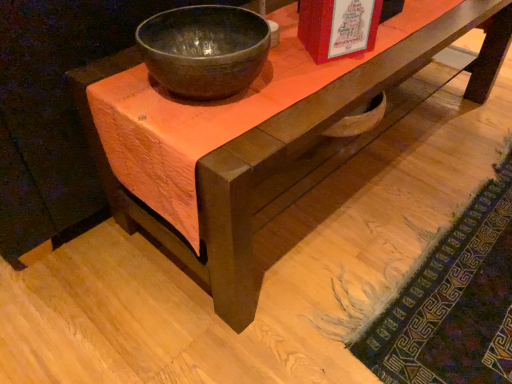
What are the coordinates of `matte dark gray bowl at center` in the screenshot? It's located at (204, 50).

Image resolution: width=512 pixels, height=384 pixels. What do you see at coordinates (204, 50) in the screenshot?
I see `matte dark gray bowl at center` at bounding box center [204, 50].

The height and width of the screenshot is (384, 512). What do you see at coordinates (453, 302) in the screenshot? I see `textured wool mat at lower right` at bounding box center [453, 302].

Image resolution: width=512 pixels, height=384 pixels. Identify the location of matte red book at upper center. (338, 27).

Is matte dark gray bowl at center next to matte red book at upper center and touching it?

No, matte dark gray bowl at center is not touching matte red book at upper center.

Is matte dark gray bowl at center behind matte red book at upper center?

No, matte dark gray bowl at center is closer to the camera.

Considering the relative sizes of matte dark gray bowl at center and matte red book at upper center in the image provided, is matte dark gray bowl at center taller than matte red book at upper center?

Incorrect, the height of matte dark gray bowl at center is not larger of that of matte red book at upper center.

From a real-world perspective, is matte dark gray bowl at center on top of matte red book at upper center?

No, from a real-world perspective, matte dark gray bowl at center is not over matte red book at upper center

From a real-world perspective, between matte dark gray bowl at center and textured wool mat at lower right, who is vertically lower?

textured wool mat at lower right, from a real-world perspective.

From the picture: Between matte dark gray bowl at center and textured wool mat at lower right, which one appears on the right side from the viewer's perspective?

Positioned to the right is textured wool mat at lower right.

Relative to textured wool mat at lower right, is matte dark gray bowl at center in front or behind?

matte dark gray bowl at center is positioned closer to the viewer than textured wool mat at lower right.

Between matte dark gray bowl at center and textured wool mat at lower right, which one has less height?

textured wool mat at lower right is shorter.

Between point (496, 326) and point (359, 46), which one is positioned behind?

The point (496, 326) is more distant.

Is textured wool mat at lower right facing away from matte red book at upper center?

No, textured wool mat at lower right is not facing the opposite direction of matte red book at upper center.

Which object is positioned more to the right, textured wool mat at lower right or matte red book at upper center?

From the viewer's perspective, textured wool mat at lower right appears more on the right side.

Is matte red book at upper center touching textured wool mat at lower right?

They are not placed beside each other.

Which object is closer to the camera, matte red book at upper center or textured wool mat at lower right?

textured wool mat at lower right is more forward.

From a real-world perspective, is matte red book at upper center on textured wool mat at lower right?

Correct, in the physical world, matte red book at upper center is higher than textured wool mat at lower right.

Is textured wool mat at lower right at the back of matte red book at upper center?

No, matte red book at upper center is not facing away from textured wool mat at lower right.

Does matte red book at upper center have a lesser height compared to matte dark gray bowl at center?

Incorrect, the height of matte red book at upper center does not fall short of that of matte dark gray bowl at center.

Looking at this image, between matte red book at upper center and matte dark gray bowl at center, which one has smaller size?

With smaller size is matte red book at upper center.

From a real-world perspective, does matte red book at upper center sit lower than matte dark gray bowl at center?

Incorrect, from a real-world perspective, matte red book at upper center is higher than matte dark gray bowl at center.

Measure the distance between matte red book at upper center and matte dark gray bowl at center.

matte red book at upper center and matte dark gray bowl at center are 21.60 centimeters apart from each other.

Considering the sizes of textured wool mat at lower right and matte dark gray bowl at center in the image, is textured wool mat at lower right wider or thinner than matte dark gray bowl at center?

Considering their sizes, textured wool mat at lower right looks broader than matte dark gray bowl at center.

Does textured wool mat at lower right turn towards matte dark gray bowl at center?

No, textured wool mat at lower right does not turn towards matte dark gray bowl at center.

Can you tell me how much textured wool mat at lower right and matte dark gray bowl at center differ in facing direction?

179 degrees separate the facing orientations of textured wool mat at lower right and matte dark gray bowl at center.

Is textured wool mat at lower right in front of matte dark gray bowl at center?

No, textured wool mat at lower right is further to the viewer.

The height and width of the screenshot is (384, 512). Identify the location of book cover behind the matte dark gray bowl at center. (338, 27).

Where is `bowl above the textured wool mat at lower right (from a real-world perspective)`? The width and height of the screenshot is (512, 384). bowl above the textured wool mat at lower right (from a real-world perspective) is located at coordinates (204, 50).

Estimate the real-world distances between objects in this image. Which object is further from matte red book at upper center, matte dark gray bowl at center or textured wool mat at lower right?

Based on the image, textured wool mat at lower right appears to be further to matte red book at upper center.

From the picture: Looking at the image, which one is located further to matte dark gray bowl at center, matte red book at upper center or textured wool mat at lower right?

textured wool mat at lower right lies further to matte dark gray bowl at center than the other object.

Considering their positions, is textured wool mat at lower right positioned further to matte dark gray bowl at center than matte red book at upper center?

Based on the image, textured wool mat at lower right appears to be further to matte dark gray bowl at center.

Based on their spatial positions, is matte red book at upper center or matte dark gray bowl at center further from textured wool mat at lower right?

matte dark gray bowl at center is positioned further to the anchor textured wool mat at lower right.

Looking at the image, which one is located closer to matte red book at upper center, textured wool mat at lower right or matte dark gray bowl at center?

matte dark gray bowl at center.

Looking at the image, which one is located further to textured wool mat at lower right, matte dark gray bowl at center or matte red book at upper center?

matte dark gray bowl at center is positioned further to the anchor textured wool mat at lower right.

Where is `book cover between matte dark gray bowl at center and textured wool mat at lower right in the horizontal direction`? This screenshot has width=512, height=384. book cover between matte dark gray bowl at center and textured wool mat at lower right in the horizontal direction is located at coordinates (338, 27).